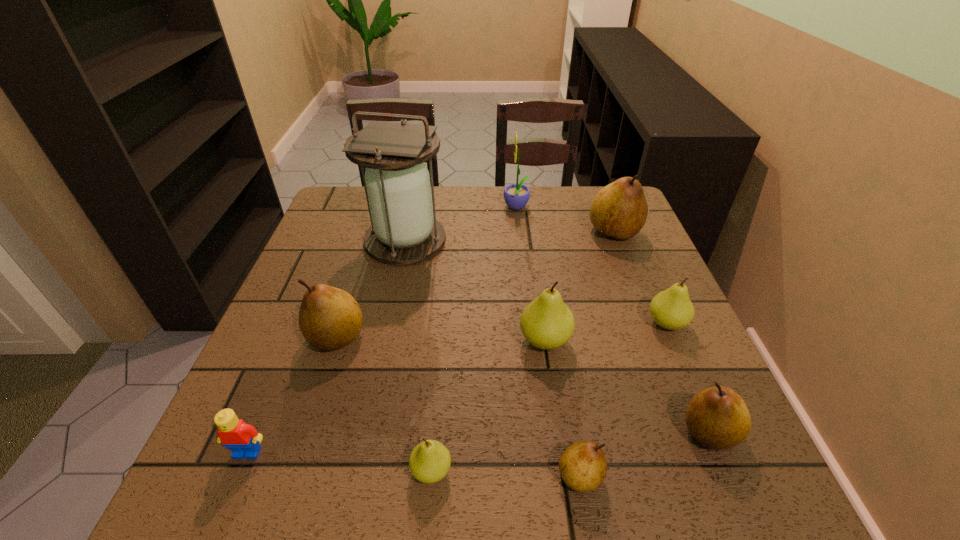
Identify the location of the sixth closest object to the second smallest brown pear. (397, 184).

Where is `the seventh closest pear to the tallest object`? the seventh closest pear to the tallest object is located at coordinates (718, 418).

Where is `pear that is the fifth closest to the sunflower`? The image size is (960, 540). pear that is the fifth closest to the sunflower is located at coordinates (718, 418).

You are a GUI agent. You are given a task and a screenshot of the screen. Output one action in this format:
    pyautogui.click(x=<x>, y=<y>)
    Task: Click on the third closest brown pear to the second farthest brown pear
    Image resolution: width=960 pixels, height=540 pixels.
    Given the screenshot: What is the action you would take?
    718,418

Where is `brown pear that stands as the second closest to the sixth pear from right to left`? This screenshot has height=540, width=960. brown pear that stands as the second closest to the sixth pear from right to left is located at coordinates (330, 318).

Choose which green pear is the nearest neighbor to the second pear from left to right. Please provide its 2D coordinates. Your answer should be formatted as a tuple, i.e. [(x, y)], where the tuple contains the x and y coordinates of a point satisfying the conditions above.

[(547, 323)]

Where is `the second closest green pear to the red Lego`? the second closest green pear to the red Lego is located at coordinates (547, 323).

This screenshot has width=960, height=540. I want to click on free point that satisfies the following two spatial constraints: 1. on the front-facing side of the sunflower; 2. on the face of the Lego, so click(544, 453).

The image size is (960, 540). I want to click on vacant area in the image that satisfies the following two spatial constraints: 1. on the front-facing side of the sunflower; 2. on the back side of the second smallest brown pear, so tap(541, 432).

Image resolution: width=960 pixels, height=540 pixels. I want to click on vacant space that satisfies the following two spatial constraints: 1. on the front-facing side of the second smallest brown pear; 2. on the right side of the sunflower, so click(541, 432).